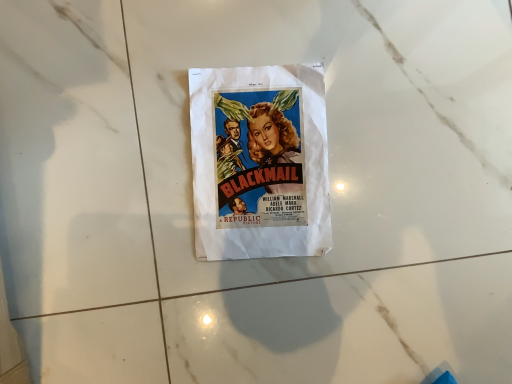
This screenshot has width=512, height=384. Identify the location of free space above matte paper poster at center (from a real-world perspective). (243, 157).